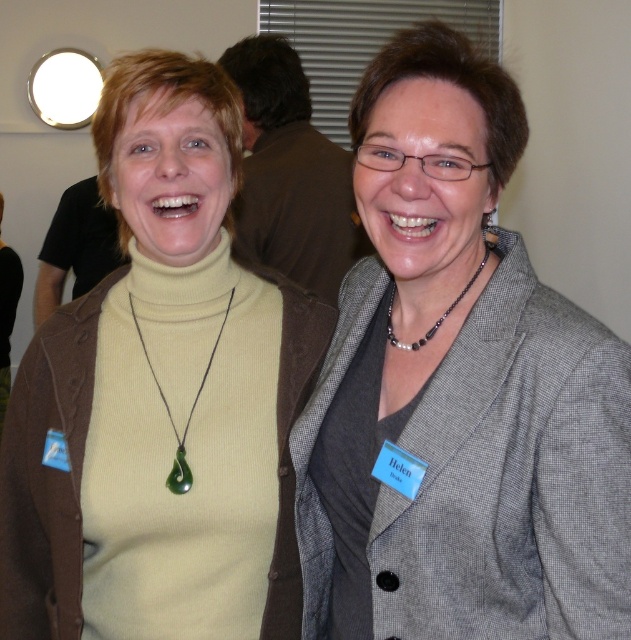
Question: Among these objects, which one is nearest to the camera?

Choices:
 (A) gray woolen blazer at upper right
 (B) matte green necklace at center

Answer: (A)

Question: Which object appears farthest from the camera in this image?

Choices:
 (A) black beaded necklace at center
 (B) green jade pendant at center
 (C) gray woolen blazer at upper right

Answer: (B)

Question: In this image, where is green jade pendant at center located relative to black beaded necklace at center?

Choices:
 (A) above
 (B) below

Answer: (B)

Question: Does gray woolen blazer at upper right appear on the right side of green jade pendant at center?

Choices:
 (A) no
 (B) yes

Answer: (B)

Question: Among these objects, which one is nearest to the camera?

Choices:
 (A) green jade pendant at center
 (B) black beaded necklace at center
 (C) matte green necklace at center

Answer: (B)

Question: Can you confirm if matte green necklace at center is wider than black beaded necklace at center?

Choices:
 (A) no
 (B) yes

Answer: (B)